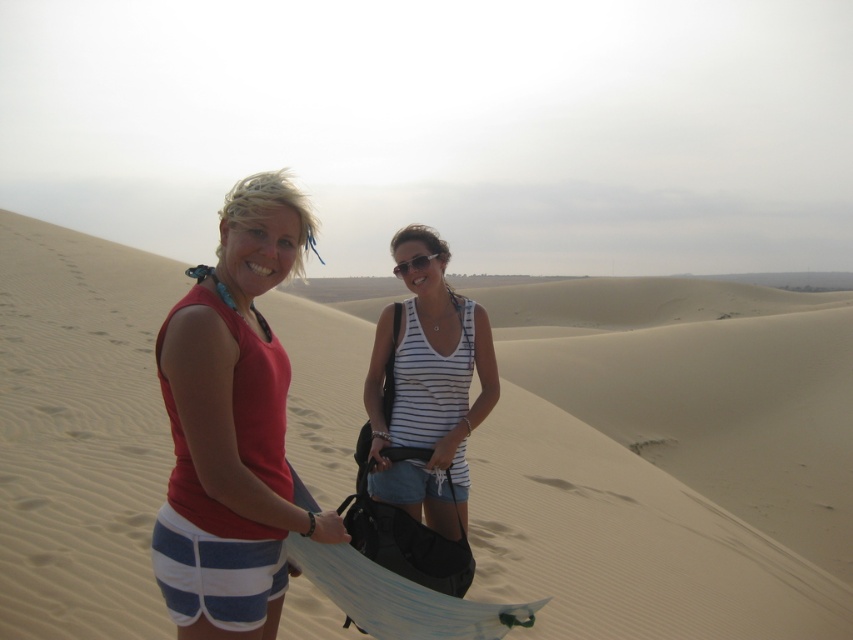
You are a photographer trying to capture a photo of both the matte red tank top at left and the white striped tank top at center. Based on their positions, which one is higher up in the image?

The matte red tank top at left is located above the white striped tank top at center, so it is higher up in the image.

You are a photographer positioned behind the two people. You want to take a photo that includes both the matte red tank top at left and the white striped tank top at center. Which person should you focus on first to ensure both are in clear focus?

You should focus on the matte red tank top at left first because it is closer to the viewer, ensuring both it and the white striped tank top at center will be in focus when using depth of field techniques.

You are a photographer trying to position yourself to capture the beige sandy dunes at center in your shot. Given their coordinates, where should you position your camera to ensure they are centered in the frame?

The beige sandy dunes at center are located at coordinates point (79,433), so positioning the camera at those coordinates will ensure they are centered in the frame.